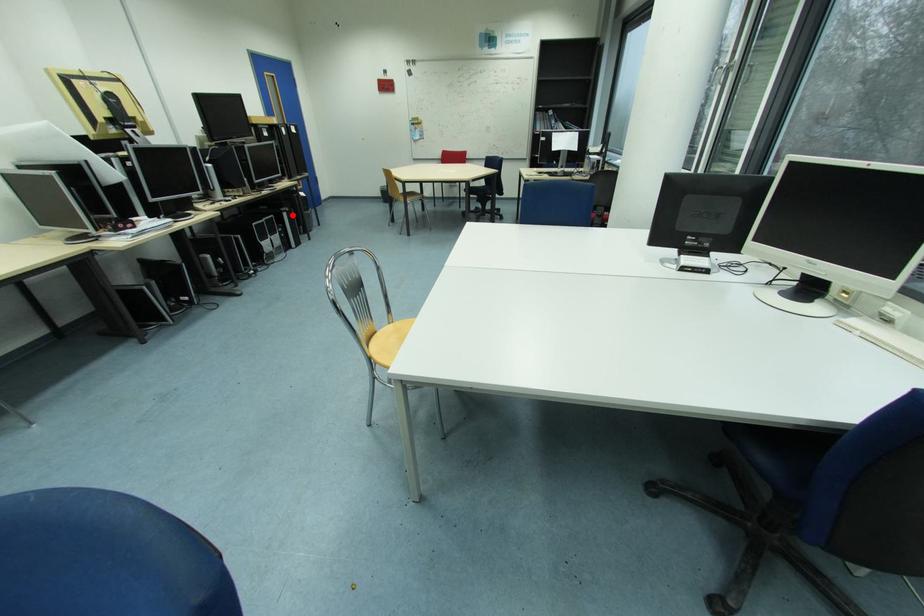
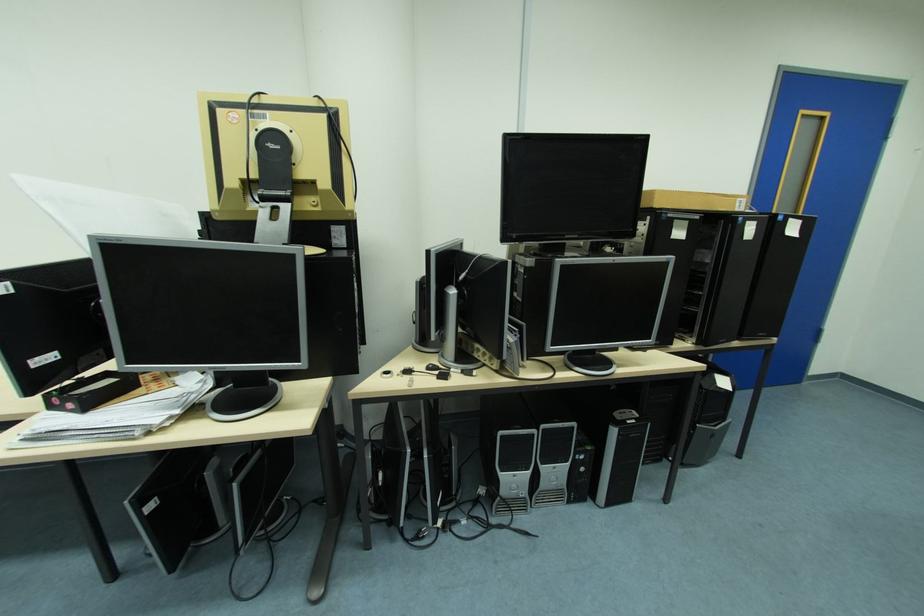
Question: I am providing you with two images of the same scene from different viewpoints. A red point is shown in image1. For the corresponding object point in image2, is it positioned nearer or farther from the camera?

Choices:
 (A) Nearer
 (B) Farther

Answer: (B)